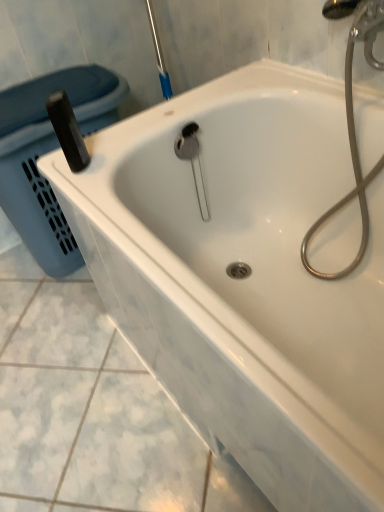
I want to click on vacant area that is in front of blue plastic laundry basket at left, so click(x=61, y=344).